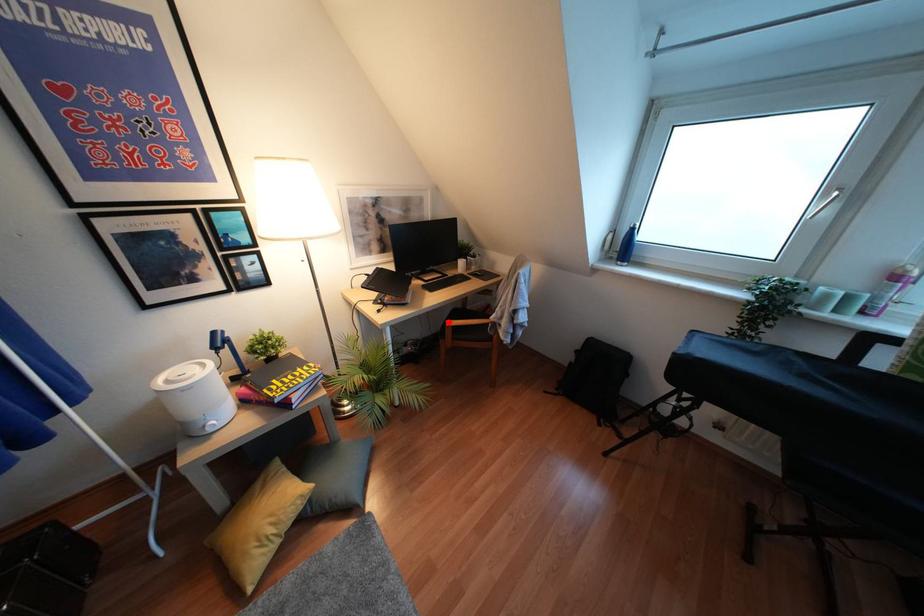
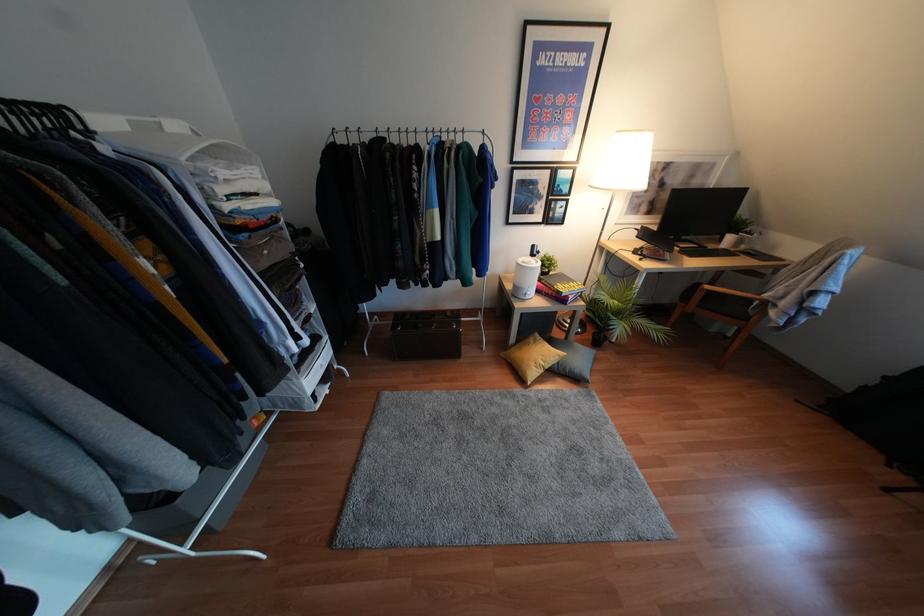
In the second image, find the point that corresponds to the highlighted location in the first image.

(707, 286)